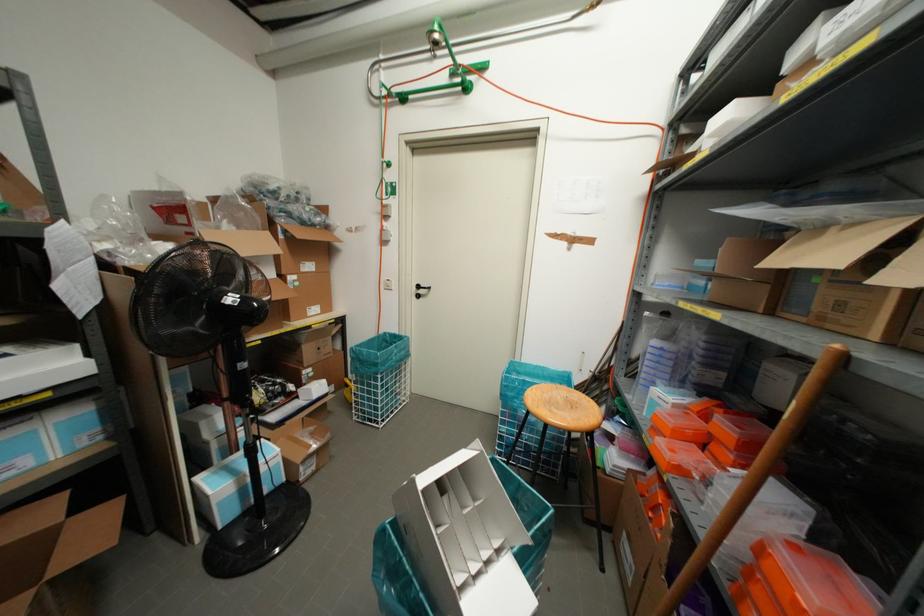
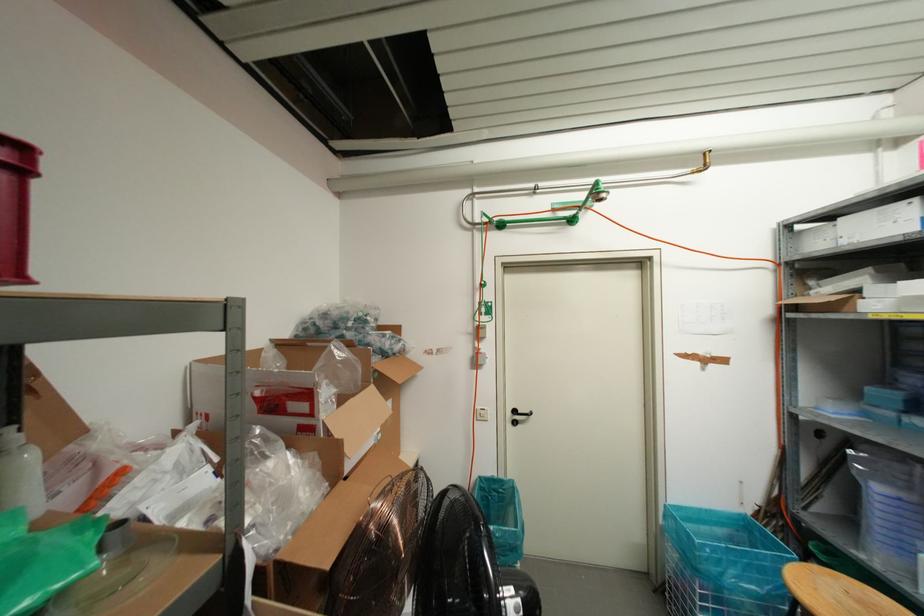
Question: In a continuous first-person perspective shot, in which direction is the camera moving?

Choices:
 (A) Left
 (B) Right
 (C) Forward
 (D) Backward

Answer: (A)